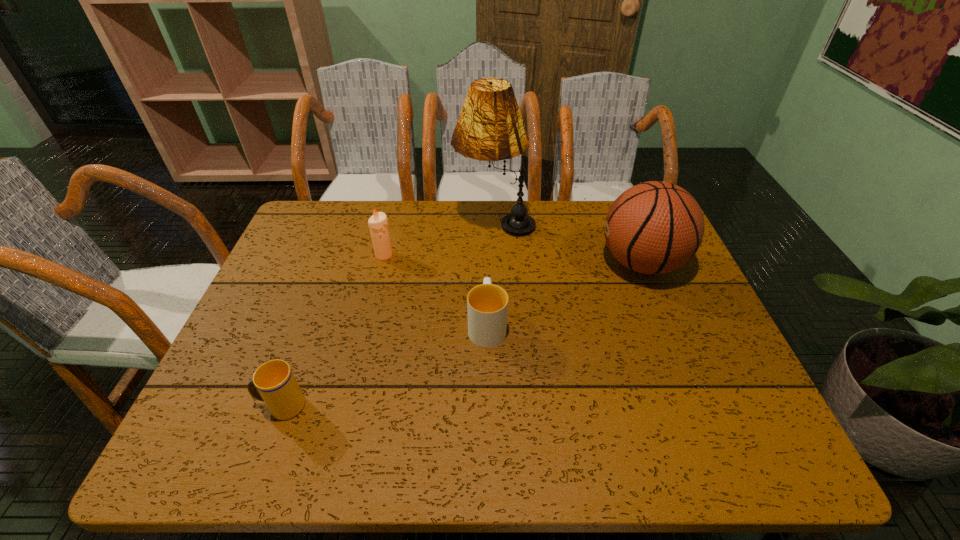
In the image, there is a desktop. At what (x,y) coordinates should I click in order to perform the action: click on vacant area at the right edge. Please return your answer as a coordinate pair (x, y). The height and width of the screenshot is (540, 960). Looking at the image, I should click on (682, 291).

Where is `vacant space at the far left corner of the desktop`? vacant space at the far left corner of the desktop is located at coordinates (311, 205).

Where is `vacant region at the near right corner of the desktop`? vacant region at the near right corner of the desktop is located at coordinates (692, 433).

Image resolution: width=960 pixels, height=540 pixels. Find the location of `unoccupied position between the farther cup and the leftmost object`. unoccupied position between the farther cup and the leftmost object is located at coordinates (384, 365).

Identify the location of free spot between the candle and the fourth farthest object. The width and height of the screenshot is (960, 540). (436, 290).

Identify the location of free space between the fourth farthest object and the candle. (436, 290).

Where is `vacant area that lies between the lampshade and the third shortest object`? vacant area that lies between the lampshade and the third shortest object is located at coordinates (439, 239).

The width and height of the screenshot is (960, 540). I want to click on free spot between the basketball and the third tallest object, so click(513, 259).

Locate an element on the screen. This screenshot has width=960, height=540. blank region between the farther cup and the left cup is located at coordinates (384, 365).

You are a GUI agent. You are given a task and a screenshot of the screen. Output one action in this format:
    pyautogui.click(x=<x>, y=<y>)
    Task: Click on the free spot between the fourth object from right to left and the fourth shortest object
    
    Given the screenshot: What is the action you would take?
    pyautogui.click(x=513, y=259)